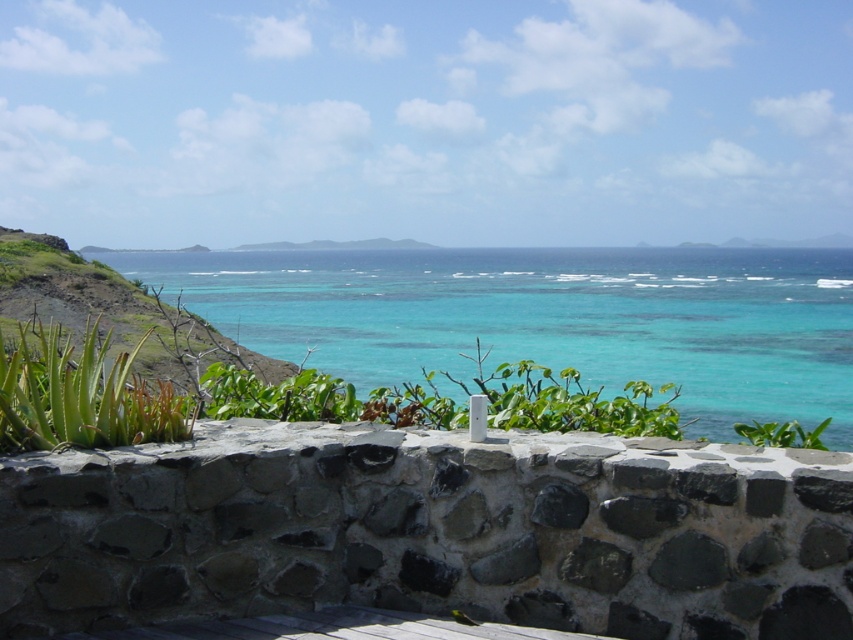
Based on the photo, you are standing at the camera position and want to place a 2.5 meter long ladder between you and the gray stone ledge at center. Will the ladder reach the ledge?

The distance between the camera and the gray stone ledge at center is 2.61 meters. Since the ladder is 2.5 meters long, it is slightly shorter than the required distance. Therefore, the ladder will not fully reach the ledge.

You are standing in front of the rustic stone wall and want to take a photo of the turquoise water at center. Where should you aim your camera to capture it?

The turquoise water at center is located at point (547, 317), so you should aim your camera at that coordinate to capture it.

You are a painter standing at the edge of the stone wall. You want to paint the turquoise water at center and the green succulent at lower left. Which object will appear larger in your painting if you focus on their height?

The turquoise water at center will appear larger in your painting because it is taller than the green succulent at lower left.